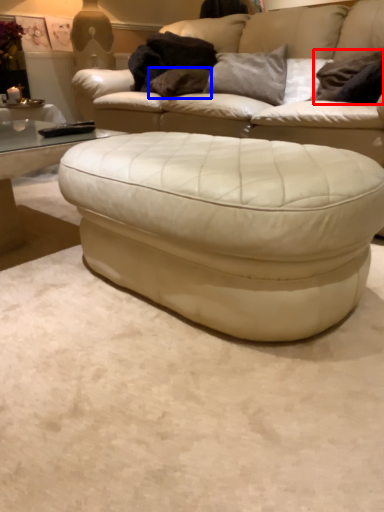
Question: Which point is closer to the camera, pillow (highlighted by a red box) or pillow (highlighted by a blue box)?

Choices:
 (A) pillow
 (B) pillow

Answer: (A)